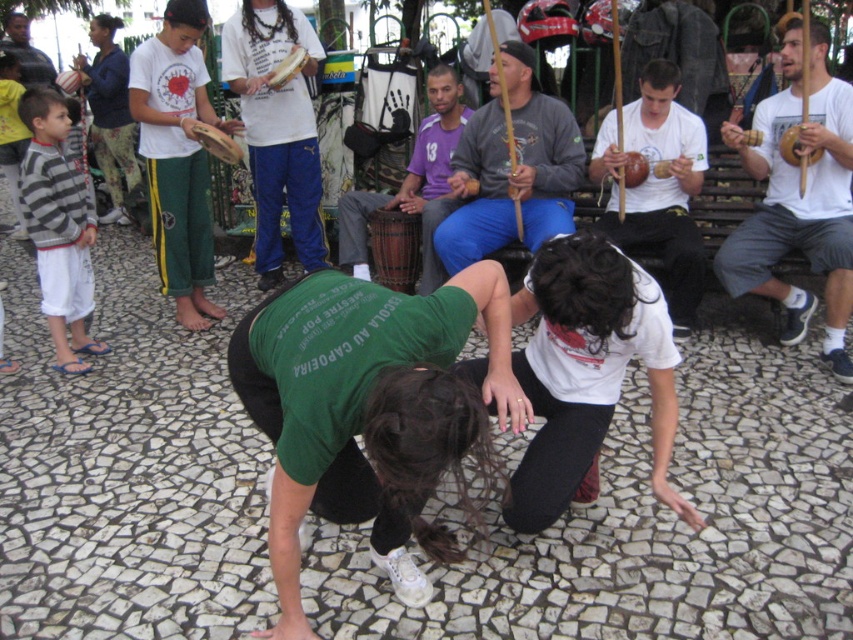
Looking at this image, is white matte shirt at center thinner than purple woven fabric at center?

Yes, white matte shirt at center is thinner than purple woven fabric at center.

Is point (525, 456) farther from camera compared to point (421, 148)?

No.

Is point (578, 339) positioned after point (422, 292)?

No.

Locate an element on the screen. white matte shirt at center is located at coordinates (587, 372).

Is white matte drum at right shorter than gray cotton sweater at center?

No.

Can you confirm if white matte drum at right is bigger than gray cotton sweater at center?

Yes, white matte drum at right is bigger than gray cotton sweater at center.

Between point (770, 250) and point (538, 163), which one is positioned in front?

Point (770, 250) is more forward.

Identify the location of white matte drum at right. The width and height of the screenshot is (853, 640). (798, 198).

Who is taller, white cotton shirt at upper left or striped sweater at left?

white cotton shirt at upper left

Who is positioned more to the left, white cotton shirt at upper left or striped sweater at left?

From the viewer's perspective, striped sweater at left appears more on the left side.

Between point (154, 99) and point (67, 356), which one is positioned in front?

Point (67, 356) is more forward.

The image size is (853, 640). Identify the location of white cotton shirt at upper left. (178, 156).